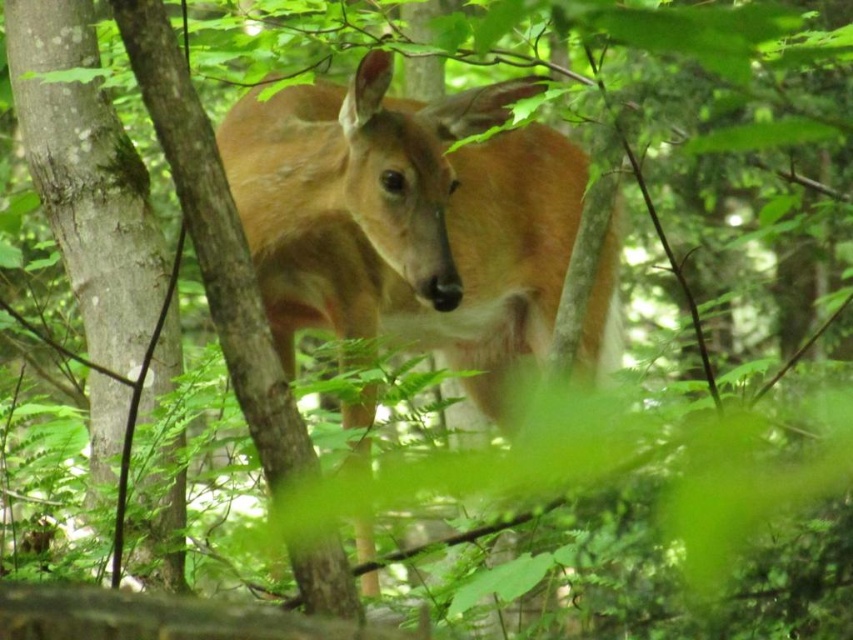
Which is more to the right, brown velvet deer at center or smooth bark tree at center?

brown velvet deer at center is more to the right.

Is point (480, 292) farther from camera compared to point (165, 563)?

Yes, point (480, 292) is behind point (165, 563).

Locate an element on the screen. The image size is (853, 640). brown velvet deer at center is located at coordinates (407, 220).